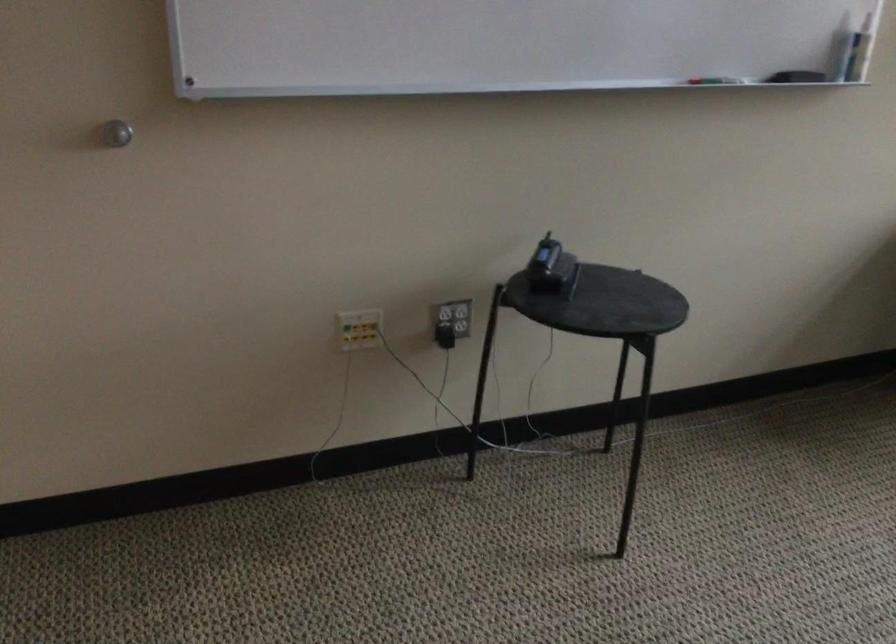
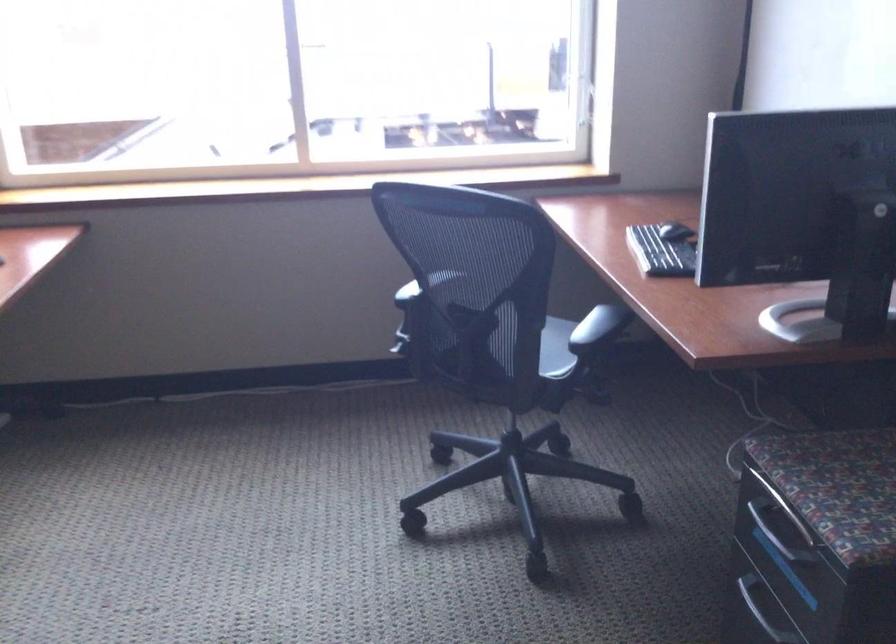
Question: How did the camera likely rotate?

Choices:
 (A) Left
 (B) Right
 (C) Up
 (D) Down

Answer: (B)